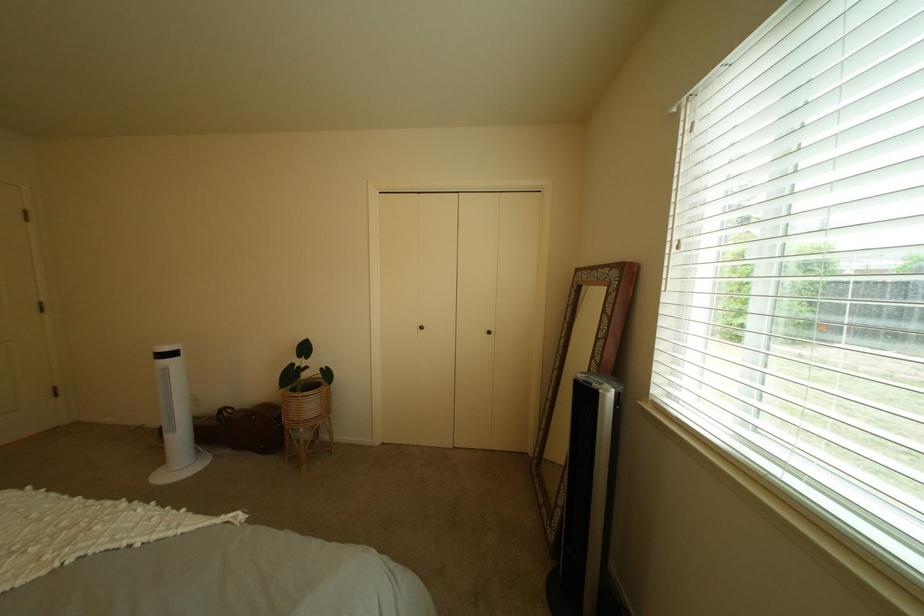
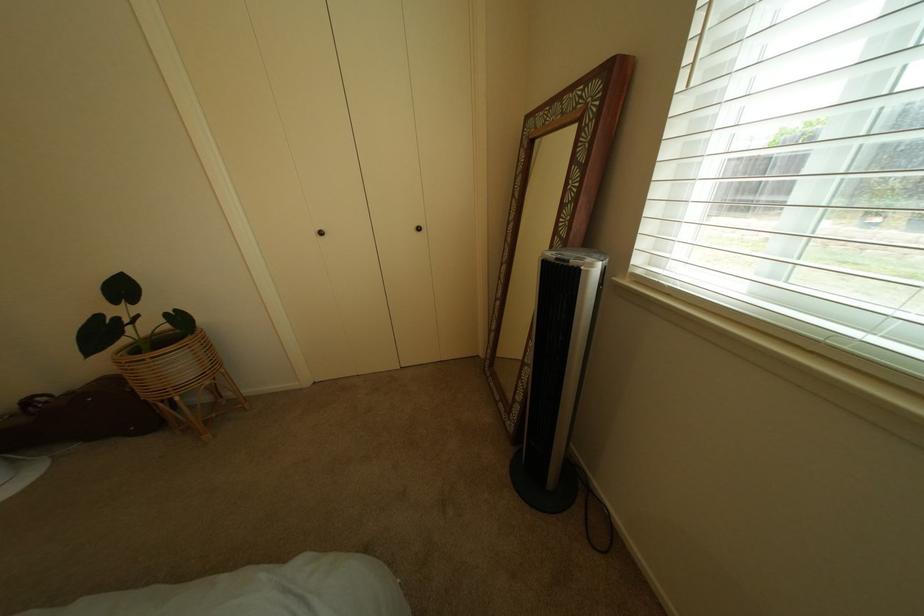
Question: How did the camera likely rotate?

Choices:
 (A) Left
 (B) Right
 (C) Up
 (D) Down

Answer: (D)